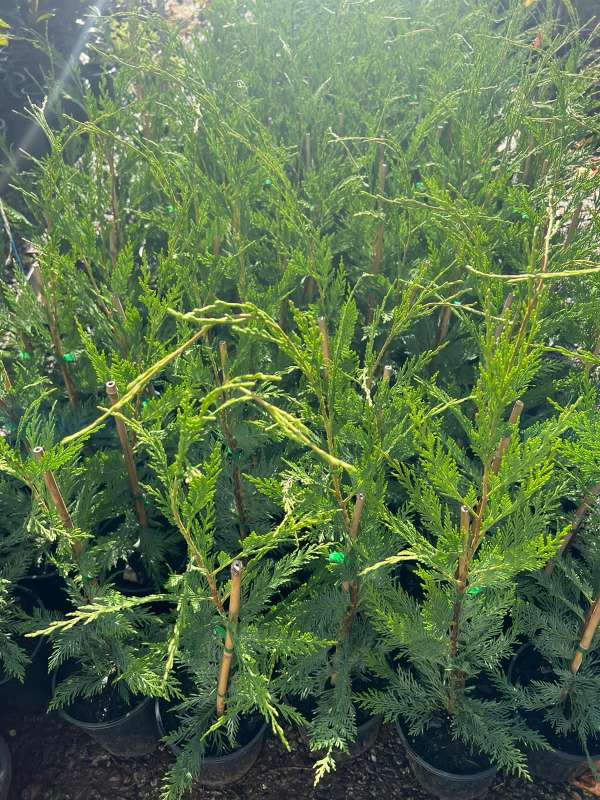
Where is `pot`? pot is located at coordinates tap(124, 737), tap(33, 686), tap(137, 590), tap(42, 569), tap(220, 764), tap(353, 744), tap(440, 772), tap(561, 762).